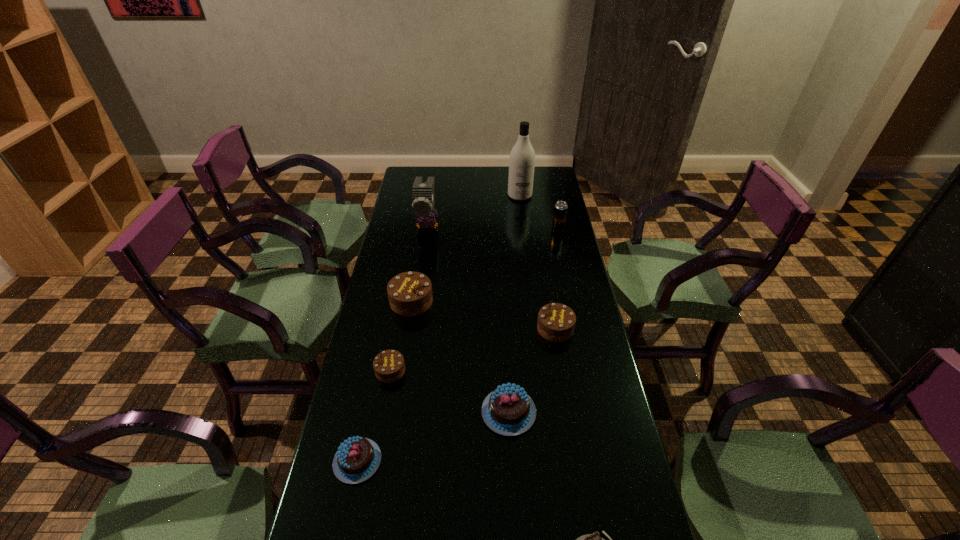
Find the location of a particular element. This screenshot has height=540, width=960. free space between the fourth nearest chocolate cake and the fourth farthest chocolate cake is located at coordinates (449, 392).

Image resolution: width=960 pixels, height=540 pixels. Find the location of `free area in between the tallest object and the left pink chocolate cake`. free area in between the tallest object and the left pink chocolate cake is located at coordinates (439, 328).

In order to click on vacant area that lies between the tallest object and the black beer can in this screenshot , I will do `click(539, 213)`.

Locate an element on the screen. vacant point located between the nearest brown chocolate cake and the smaller pink chocolate cake is located at coordinates (374, 416).

You are a GUI agent. You are given a task and a screenshot of the screen. Output one action in this format:
    pyautogui.click(x=<x>, y=<y>)
    Task: Click on the vacant space that is in between the third farthest chocolate cake and the left pink chocolate cake
    The height and width of the screenshot is (540, 960).
    Given the screenshot: What is the action you would take?
    pyautogui.click(x=374, y=416)

Locate an element on the screen. This screenshot has height=540, width=960. object that can be found as the third closest to the shampoo is located at coordinates (410, 293).

Identify which object is located as the fifth nearest to the nearest chocolate cake. Please provide its 2D coordinates. Your answer should be formatted as a tuple, i.e. [(x, y)], where the tuple contains the x and y coordinates of a point satisfying the conditions above.

[(410, 293)]

At what (x,y) coordinates should I click in order to perform the action: click on chocolate cake that can be found as the sixth closest to the bird. Please return your answer as a coordinate pair (x, y). This screenshot has width=960, height=540. Looking at the image, I should click on (594, 539).

Select which chocolate cake is the closest to the biggest brown chocolate cake. Please provide its 2D coordinates. Your answer should be formatted as a tuple, i.e. [(x, y)], where the tuple contains the x and y coordinates of a point satisfying the conditions above.

[(389, 366)]

Locate which brown chocolate cake is the third closest to the nearest object. Please provide its 2D coordinates. Your answer should be formatted as a tuple, i.e. [(x, y)], where the tuple contains the x and y coordinates of a point satisfying the conditions above.

[(410, 293)]